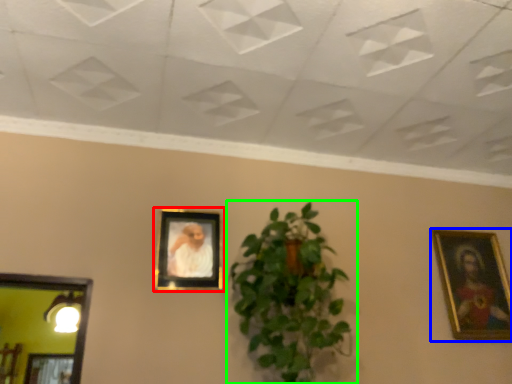
Question: Which object is the farthest from picture frame (highlighted by a red box)? Choose among these: picture frame (highlighted by a blue box) or houseplant (highlighted by a green box).

Choices:
 (A) picture frame
 (B) houseplant

Answer: (A)